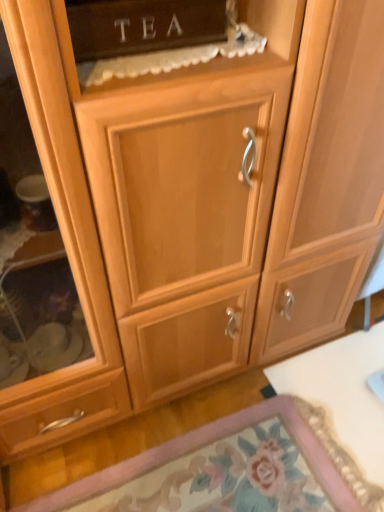
The height and width of the screenshot is (512, 384). Describe the element at coordinates (142, 26) in the screenshot. I see `matte wood tea cabinet at upper center` at that location.

Image resolution: width=384 pixels, height=512 pixels. Describe the element at coordinates (342, 393) in the screenshot. I see `white glossy table at lower right` at that location.

Locate an element on the screen. This screenshot has width=384, height=512. matte wood tea cabinet at upper center is located at coordinates (142, 26).

Does white glossy table at lower right have a larger size compared to matte wood tea cabinet at upper center?

Yes, white glossy table at lower right is bigger than matte wood tea cabinet at upper center.

From a real-world perspective, is white glossy table at lower right over matte wood tea cabinet at upper center?

No, from a real-world perspective, white glossy table at lower right is not on top of matte wood tea cabinet at upper center.

Can you confirm if white glossy table at lower right is taller than matte wood tea cabinet at upper center?

In fact, white glossy table at lower right may be shorter than matte wood tea cabinet at upper center.

Looking at this image, from the image's perspective, which one is positioned higher, matte wood tea cabinet at upper center or white glossy table at lower right?

matte wood tea cabinet at upper center.

How far apart are matte wood tea cabinet at upper center and white glossy table at lower right?

The distance of matte wood tea cabinet at upper center from white glossy table at lower right is 3.83 feet.

Considering the sizes of objects matte wood tea cabinet at upper center and white glossy table at lower right in the image provided, who is wider, matte wood tea cabinet at upper center or white glossy table at lower right?

white glossy table at lower right.

What's the angular difference between matte wood tea cabinet at upper center and white glossy table at lower right's facing directions?

89.9 degrees separate the facing orientations of matte wood tea cabinet at upper center and white glossy table at lower right.

From a real-world perspective, is white glossy table at lower right positioned above or below wooden cabinet door at lower center?

In terms of real-world spatial position, white glossy table at lower right is above wooden cabinet door at lower center.

Is white glossy table at lower right closer to the viewer compared to wooden cabinet door at lower center?

Result: No, it is not.

Is white glossy table at lower right placed right next to wooden cabinet door at lower center?

No, white glossy table at lower right is not beside wooden cabinet door at lower center.

Based on their sizes in the image, would you say matte wood tea cabinet at upper center is bigger or smaller than wooden cabinet door at lower center?

matte wood tea cabinet at upper center is smaller than wooden cabinet door at lower center.

Is matte wood tea cabinet at upper center facing towards wooden cabinet door at lower center?

No, matte wood tea cabinet at upper center is not facing towards wooden cabinet door at lower center.

Does matte wood tea cabinet at upper center have a greater height compared to wooden cabinet door at lower center?

Correct, matte wood tea cabinet at upper center is much taller as wooden cabinet door at lower center.

Which object is further away from the camera, matte wood tea cabinet at upper center or wooden cabinet door at lower center?

wooden cabinet door at lower center is more distant.

Which is in front, wooden cabinet door at lower center or white glossy table at lower right?

wooden cabinet door at lower center.

Does point (276, 490) lie in front of point (383, 474)?

Yes, point (276, 490) is in front of point (383, 474).

From the image's perspective, between wooden cabinet door at lower center and white glossy table at lower right, which one is located above?

white glossy table at lower right.

From the picture: Does wooden cabinet door at lower center appear on the left side of matte wood tea cabinet at upper center?

Incorrect, wooden cabinet door at lower center is not on the left side of matte wood tea cabinet at upper center.

Is wooden cabinet door at lower center turned away from matte wood tea cabinet at upper center?

No, matte wood tea cabinet at upper center is not at the back of wooden cabinet door at lower center.

You are a GUI agent. You are given a task and a screenshot of the screen. Output one action in this format:
    pyautogui.click(x=<x>, y=<y>)
    Task: Click on the cabinetry lying on the left of wooden cabinet door at lower center
    This screenshot has width=384, height=512.
    Given the screenshot: What is the action you would take?
    pyautogui.click(x=142, y=26)

How different are the orientations of wooden cabinet door at lower center and matte wood tea cabinet at upper center in degrees?

There is a 90-degree angle between the facing directions of wooden cabinet door at lower center and matte wood tea cabinet at upper center.

In the image, there is a white glossy table at lower right. Where is `cabinetry above it (from the image's perspective)`? The width and height of the screenshot is (384, 512). cabinetry above it (from the image's perspective) is located at coordinates (142, 26).

Locate an element on the screen. The image size is (384, 512). table that appears behind the matte wood tea cabinet at upper center is located at coordinates (342, 393).

From the image, which object appears to be nearer to white glossy table at lower right, wooden cabinet door at lower center or matte wood tea cabinet at upper center?

wooden cabinet door at lower center is closer to white glossy table at lower right.

When comparing their distances from matte wood tea cabinet at upper center, does wooden cabinet door at lower center or white glossy table at lower right seem further?

The object further to matte wood tea cabinet at upper center is white glossy table at lower right.

Consider the image. Looking at the image, which one is located closer to matte wood tea cabinet at upper center, white glossy table at lower right or wooden cabinet door at lower center?

Based on the image, wooden cabinet door at lower center appears to be nearer to matte wood tea cabinet at upper center.

Based on their spatial positions, is matte wood tea cabinet at upper center or wooden cabinet door at lower center closer to white glossy table at lower right?

Among the two, wooden cabinet door at lower center is located nearer to white glossy table at lower right.

When comparing their distances from wooden cabinet door at lower center, does matte wood tea cabinet at upper center or white glossy table at lower right seem closer?

white glossy table at lower right is closer to wooden cabinet door at lower center.

Based on their spatial positions, is white glossy table at lower right or matte wood tea cabinet at upper center further from wooden cabinet door at lower center?

matte wood tea cabinet at upper center.

Identify the location of table that lies between matte wood tea cabinet at upper center and wooden cabinet door at lower center from top to bottom. (342, 393).